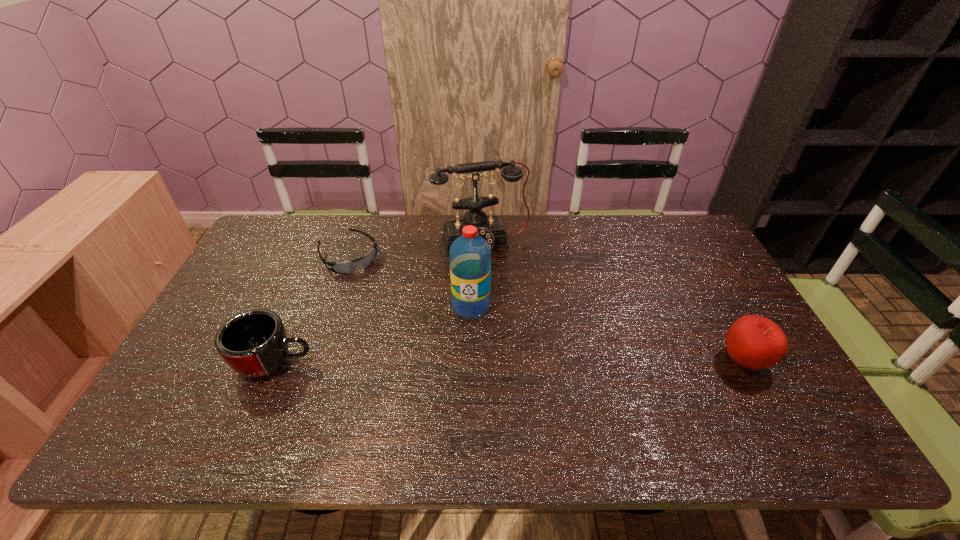
This screenshot has height=540, width=960. I want to click on object that stands as the second closest to the water bottle, so click(x=349, y=267).

Select which object is the third closest to the water bottle. Please provide its 2D coordinates. Your answer should be formatted as a tuple, i.e. [(x, y)], where the tuple contains the x and y coordinates of a point satisfying the conditions above.

[(254, 344)]

Identify the location of free space in the image that satisfies the following two spatial constraints: 1. on the front side of the rightmost object; 2. on the left side of the telephone. Image resolution: width=960 pixels, height=540 pixels. (483, 361).

At what (x,y) coordinates should I click in order to perform the action: click on vacant space that satisfies the following two spatial constraints: 1. on the front side of the shortest object; 2. on the right side of the water bottle. Please return your answer as a coordinate pair (x, y). Looking at the image, I should click on (331, 306).